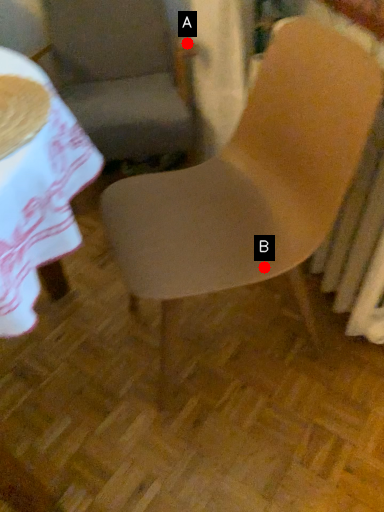
Question: Two points are circled on the image, labeled by A and B beside each circle. Which point is farther from the camera taking this photo?

Choices:
 (A) A is further
 (B) B is further

Answer: (A)